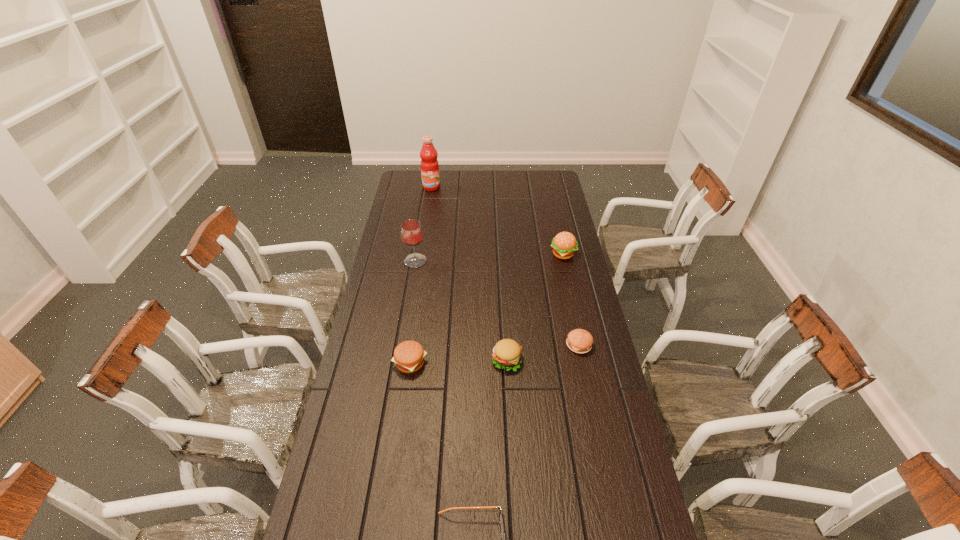
Where is `vacant space located 0.090m on the left of the tallest hamburger`? vacant space located 0.090m on the left of the tallest hamburger is located at coordinates (530, 254).

Where is `free space located 0.270m on the back of the second hamburger from left to right`? The image size is (960, 540). free space located 0.270m on the back of the second hamburger from left to right is located at coordinates (503, 295).

Identify the location of free location located 0.240m on the right of the leftmost hamburger. This screenshot has height=540, width=960. (496, 363).

Identify the location of free space located on the left of the shortest hamburger. (506, 345).

Where is `object that is at the far edge`? Image resolution: width=960 pixels, height=540 pixels. object that is at the far edge is located at coordinates (429, 164).

Where is `fruit juice present at the left edge`? The image size is (960, 540). fruit juice present at the left edge is located at coordinates [x=429, y=164].

Where is `wineglass at the left edge`? The height and width of the screenshot is (540, 960). wineglass at the left edge is located at coordinates (411, 232).

Find the location of a particular element. Image resolution: width=960 pixels, height=540 pixels. hamburger present at the left edge is located at coordinates (409, 356).

This screenshot has height=540, width=960. I want to click on object present at the far left corner, so click(x=429, y=164).

You are a GUI agent. You are given a task and a screenshot of the screen. Output one action in this format:
    pyautogui.click(x=<x>, y=<y>)
    Task: Click on the vacant space at the far edge of the desktop
    This screenshot has height=540, width=960.
    Given the screenshot: What is the action you would take?
    pyautogui.click(x=508, y=189)